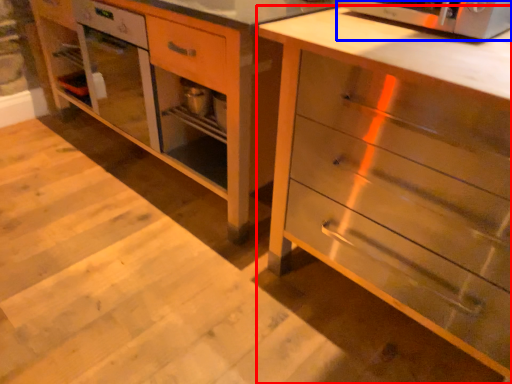
Question: Which of the following is the farthest to the observer, chest of drawers (highlighted by a red box) or microwave oven (highlighted by a blue box)?

Choices:
 (A) chest of drawers
 (B) microwave oven

Answer: (B)